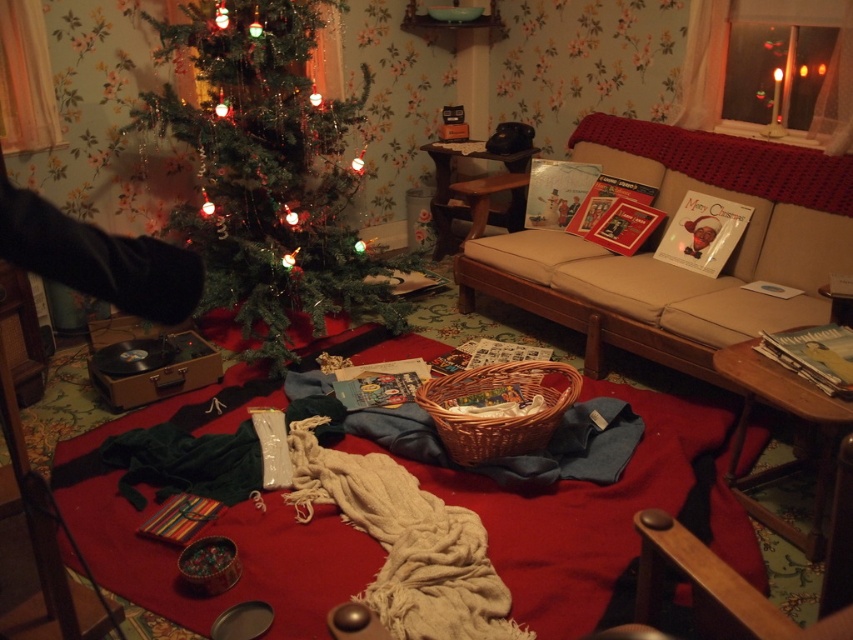
What are the coordinates of the green matte christmas tree at center?

The green matte christmas tree at center is located at coordinates point (270, 173).